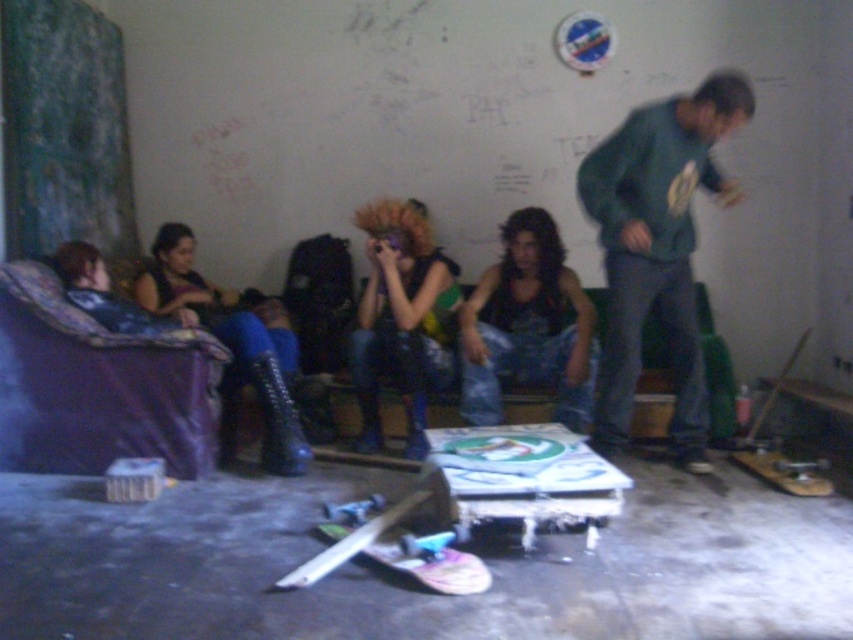
Is point (587, 384) less distant than point (424, 406)?

Yes, point (587, 384) is in front of point (424, 406).

Is point (590, 365) farther from viewer compared to point (434, 296)?

No.

Is point (567, 285) closer to camera compared to point (364, 326)?

No, it is not.

Locate an element on the screen. denim jeans at center is located at coordinates pyautogui.click(x=527, y=324).

Does green matte sweatshirt at right have a larger size compared to shiny purple hair at center?

No, green matte sweatshirt at right is not bigger than shiny purple hair at center.

What do you see at coordinates (659, 248) in the screenshot? The width and height of the screenshot is (853, 640). I see `green matte sweatshirt at right` at bounding box center [659, 248].

This screenshot has height=640, width=853. What do you see at coordinates (659, 248) in the screenshot?
I see `green matte sweatshirt at right` at bounding box center [659, 248].

I want to click on green matte sweatshirt at right, so click(659, 248).

Is the position of leather boots at lower left less distant than that of white wooden skateboard at center?

That is False.

Is leather boots at lower left further to camera compared to white wooden skateboard at center?

Yes, leather boots at lower left is behind white wooden skateboard at center.

Between point (142, 296) and point (370, 531), which one is positioned behind?

Point (142, 296)

At what (x,y) coordinates should I click in order to perform the action: click on leather boots at lower left. Please return your answer as a coordinate pair (x, y). Looking at the image, I should click on (231, 340).